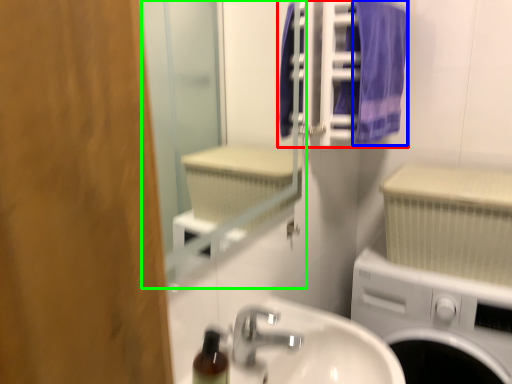
Question: Which object is positioned closest to laundry (highlighted by a red box)? Select from bath towel (highlighted by a blue box) and mirror (highlighted by a green box).

Choices:
 (A) bath towel
 (B) mirror

Answer: (A)